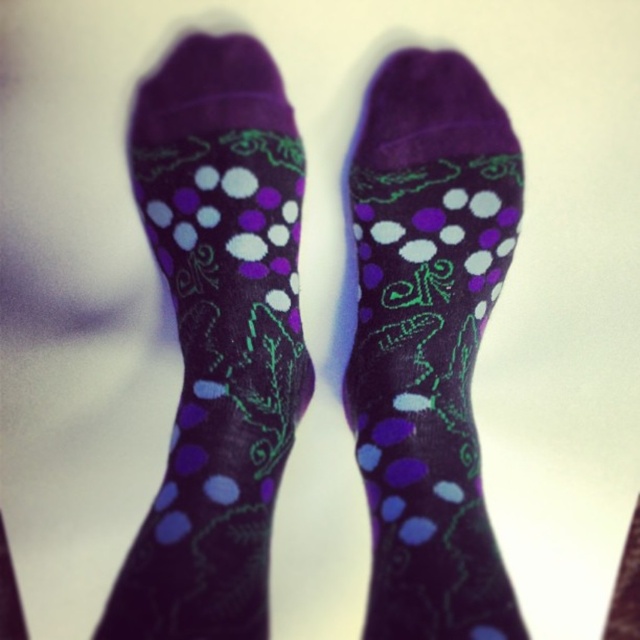
Which of these two, purple dotted socks at center or purple matte socks at center, stands shorter?

With less height is purple matte socks at center.

Between point (227, 518) and point (396, 90), which one is positioned in front?

Point (227, 518)

Is point (129, 584) behind point (429, 124)?

No, (129, 584) is in front of (429, 124).

Locate an element on the screen. The image size is (640, 640). purple dotted socks at center is located at coordinates (218, 336).